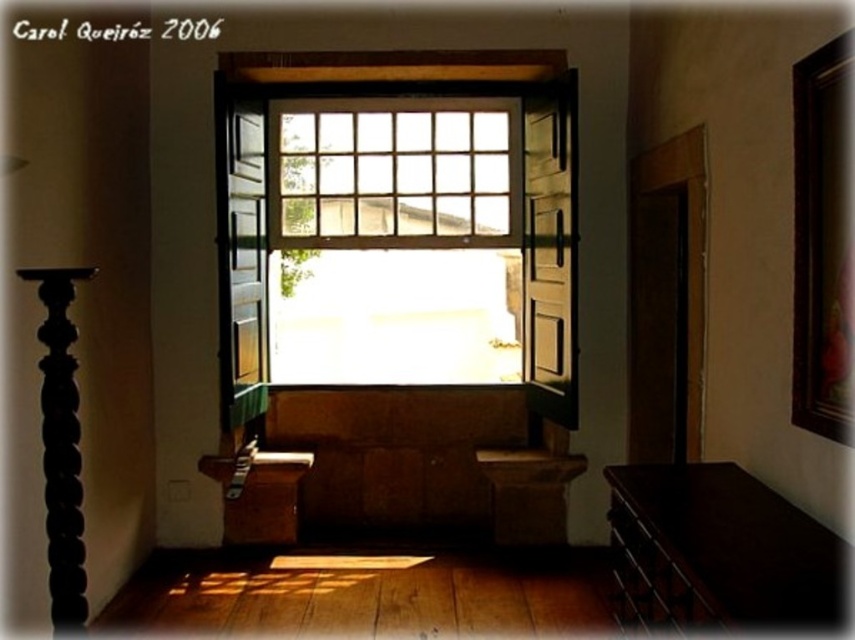
The width and height of the screenshot is (855, 640). Find the location of `wooden bench at center`. wooden bench at center is located at coordinates (399, 465).

Is wooden bench at center below black wood pillar at left?

Correct, wooden bench at center is located below black wood pillar at left.

Does point (439, 480) come farther from viewer compared to point (28, 269)?

Yes, point (439, 480) is farther from viewer.

Find the location of `wooden bench at center`. wooden bench at center is located at coordinates (399, 465).

Between wooden at center and black wood pillar at left, which one has less height?

black wood pillar at left is shorter.

Measure the distance between wooden at center and black wood pillar at left.

They are 2.17 meters apart.

I want to click on wooden at center, so click(x=399, y=211).

Image resolution: width=855 pixels, height=640 pixels. In order to click on wooden at center in this screenshot , I will do [399, 211].

Does dark wood balustrade at lower right have a greater width compared to black wood pillar at left?

Correct, the width of dark wood balustrade at lower right exceeds that of black wood pillar at left.

Is point (641, 540) positioned after point (84, 554)?

That is False.

I want to click on dark wood balustrade at lower right, so click(x=717, y=550).